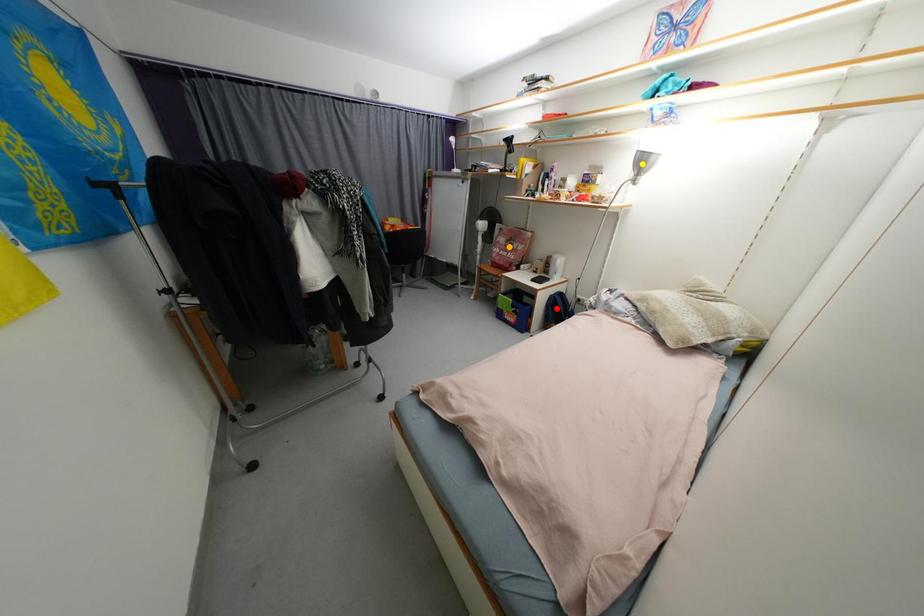
Order these from nearest to farthest:
red point
orange point
yellow point

yellow point < red point < orange point